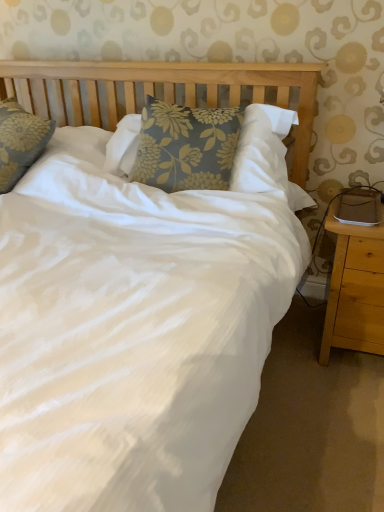
Question: Should I look upward or downward to see blue floral pillow at center?

Choices:
 (A) up
 (B) down

Answer: (A)

Question: Considering the relative positions of light brown wood nightstand at lower right and blue floral pillow at center in the image provided, is light brown wood nightstand at lower right to the left of blue floral pillow at center from the viewer's perspective?

Choices:
 (A) no
 (B) yes

Answer: (A)

Question: Is light brown wood nightstand at lower right facing towards blue floral pillow at center?

Choices:
 (A) yes
 (B) no

Answer: (B)

Question: From a real-world perspective, is light brown wood nightstand at lower right beneath blue floral pillow at center?

Choices:
 (A) no
 (B) yes

Answer: (B)

Question: From the image's perspective, is light brown wood nightstand at lower right located beneath blue floral pillow at center?

Choices:
 (A) yes
 (B) no

Answer: (A)

Question: Is light brown wood nightstand at lower right in front of blue floral pillow at center?

Choices:
 (A) yes
 (B) no

Answer: (A)

Question: From the image's perspective, is light brown wood nightstand at lower right on top of blue floral pillow at center?

Choices:
 (A) no
 (B) yes

Answer: (A)

Question: Is blue floral pillow at center shorter than light brown wood nightstand at lower right?

Choices:
 (A) no
 (B) yes

Answer: (B)

Question: Is blue floral pillow at center next to light brown wood nightstand at lower right and touching it?

Choices:
 (A) no
 (B) yes

Answer: (A)

Question: Is blue floral pillow at center at the right side of light brown wood nightstand at lower right?

Choices:
 (A) no
 (B) yes

Answer: (A)

Question: Is blue floral pillow at center oriented towards light brown wood nightstand at lower right?

Choices:
 (A) yes
 (B) no

Answer: (B)

Question: From a real-world perspective, is blue floral pillow at center beneath light brown wood nightstand at lower right?

Choices:
 (A) yes
 (B) no

Answer: (B)

Question: Is blue floral pillow at center smaller than light brown wood nightstand at lower right?

Choices:
 (A) no
 (B) yes

Answer: (A)

Question: Looking at their shapes, would you say blue floral pillow at center is wider or thinner than light brown wood nightstand at lower right?

Choices:
 (A) thin
 (B) wide

Answer: (A)